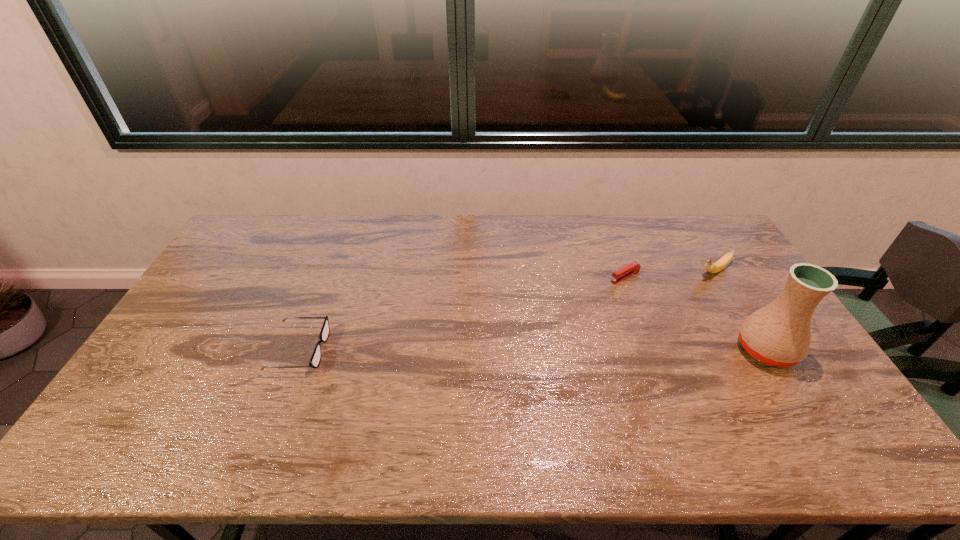
The image size is (960, 540). Find the location of `free space between the leftmost object and the second object from left to right`. free space between the leftmost object and the second object from left to right is located at coordinates (463, 313).

Find the location of `unoccupied position between the spectacles and the second tallest object`. unoccupied position between the spectacles and the second tallest object is located at coordinates (507, 310).

At what (x,y) coordinates should I click in order to perform the action: click on free space between the stapler and the spectacles. Please return your answer as a coordinate pair (x, y). The height and width of the screenshot is (540, 960). Looking at the image, I should click on (463, 313).

Find the location of a particular element. The height and width of the screenshot is (540, 960). free space between the leftmost object and the pottery is located at coordinates (533, 349).

The height and width of the screenshot is (540, 960). I want to click on free point between the stapler and the pottery, so click(695, 313).

You are a GUI agent. You are given a task and a screenshot of the screen. Output one action in this format:
    pyautogui.click(x=<x>, y=<y>)
    Task: Click on the free space between the pottery and the leftmost object
    The height and width of the screenshot is (540, 960).
    Given the screenshot: What is the action you would take?
    pyautogui.click(x=533, y=349)

I want to click on vacant area between the spectacles and the banana, so click(507, 310).

Where is `free spot between the stapler and the third shortest object`? The width and height of the screenshot is (960, 540). free spot between the stapler and the third shortest object is located at coordinates (669, 274).

I want to click on empty space between the leftmost object and the second tallest object, so click(507, 310).

Locate an element on the screen. The image size is (960, 540). vacant space in between the second object from left to right and the leftmost object is located at coordinates (463, 313).